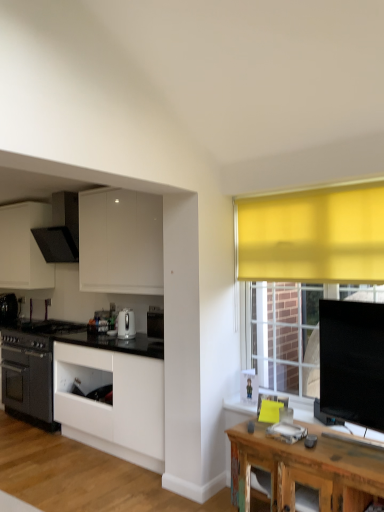
Question: Is matte black range hood at upper left, the 2th kitchen appliance in the back-to-front sequence, wider than black matte oven at left, acting as the third kitchen appliance starting from the right?

Choices:
 (A) no
 (B) yes

Answer: (B)

Question: Considering the relative sizes of matte black range hood at upper left, the 3th kitchen appliance ordered from the bottom, and black matte oven at left, the 3th kitchen appliance when ordered from front to back, in the image provided, is matte black range hood at upper left, the 3th kitchen appliance ordered from the bottom, taller than black matte oven at left, the 3th kitchen appliance when ordered from front to back,?

Choices:
 (A) no
 (B) yes

Answer: (B)

Question: From the image's perspective, is matte black range hood at upper left, the 3th kitchen appliance ordered from the bottom, under black matte oven at left, acting as the third kitchen appliance starting from the right?

Choices:
 (A) no
 (B) yes

Answer: (A)

Question: Is matte black range hood at upper left, which appears as the first kitchen appliance when viewed from the top, positioned behind black matte oven at left, the 3th kitchen appliance when ordered from front to back?

Choices:
 (A) no
 (B) yes

Answer: (A)

Question: Does matte black range hood at upper left, the 2th kitchen appliance from the front, lie in front of black matte oven at left, which is the 1th kitchen appliance from left to right?

Choices:
 (A) no
 (B) yes

Answer: (B)

Question: From the image's perspective, is matte black range hood at upper left, which is the second kitchen appliance from left to right, on black matte oven at left, positioned as the 1th kitchen appliance in back-to-front order?

Choices:
 (A) yes
 (B) no

Answer: (A)

Question: Can you confirm if black matte oven at left, positioned as the 1th kitchen appliance in bottom-to-top order, is shorter than rustic wood table at lower right?

Choices:
 (A) no
 (B) yes

Answer: (B)

Question: Can you confirm if black matte oven at left, the 3th kitchen appliance when ordered from front to back, is smaller than rustic wood table at lower right?

Choices:
 (A) no
 (B) yes

Answer: (B)

Question: Is black matte oven at left, positioned as the 1th kitchen appliance in back-to-front order, bigger than rustic wood table at lower right?

Choices:
 (A) no
 (B) yes

Answer: (A)

Question: From a real-world perspective, is black matte oven at left, the third kitchen appliance viewed from the top, beneath rustic wood table at lower right?

Choices:
 (A) yes
 (B) no

Answer: (B)

Question: Is black matte oven at left, the third kitchen appliance viewed from the top, positioned with its back to rustic wood table at lower right?

Choices:
 (A) yes
 (B) no

Answer: (B)

Question: From the image's perspective, is black matte oven at left, positioned as the 1th kitchen appliance in back-to-front order, below rustic wood table at lower right?

Choices:
 (A) no
 (B) yes

Answer: (A)

Question: Does black matte oven at left, the third kitchen appliance viewed from the top, have a lesser width compared to matte black range hood at upper left, the 3th kitchen appliance ordered from the bottom?

Choices:
 (A) yes
 (B) no

Answer: (A)